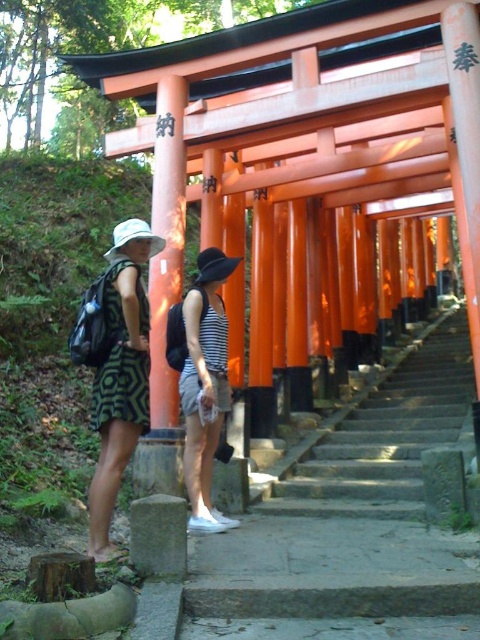
Consider the image. You are standing at the base of the torii gate staircase and want to take a photo of two points marked in the scene. The first point is at coordinates point (348, 435) and the second is at point (312, 490). Which point will appear closer to you in the photo?

Point (348, 435) is further to the camera than point (312, 490), so in the photo, point (312, 490) will appear closer to you.